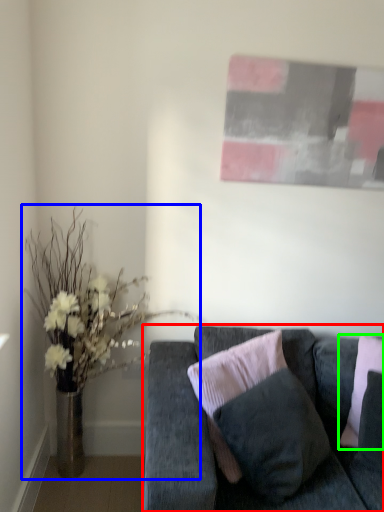
Question: Based on their relative distances, which object is farther from studio couch (highlighted by a red box)? Choose from houseplant (highlighted by a blue box) and pillow (highlighted by a green box).

Choices:
 (A) houseplant
 (B) pillow

Answer: (A)